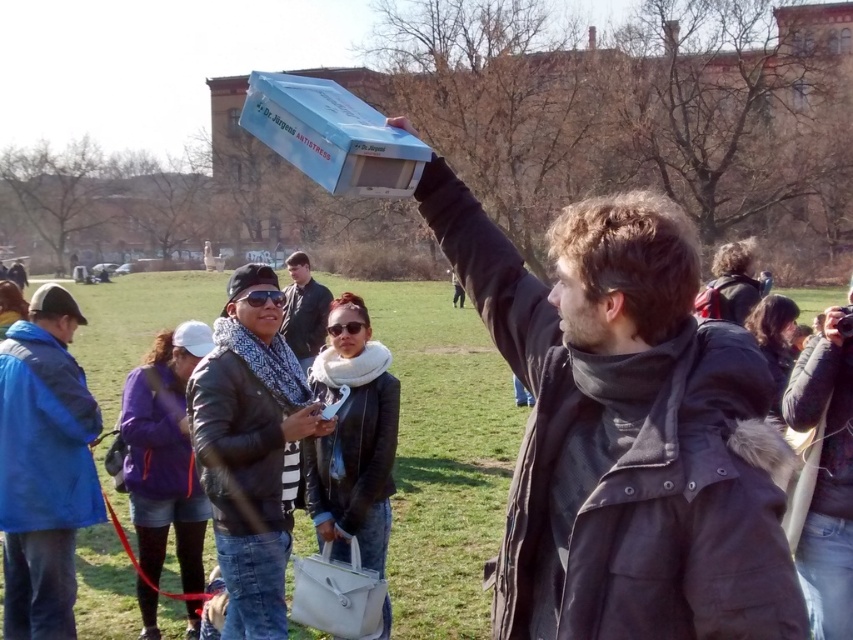
Question: Which point appears closest to the camera in this image?

Choices:
 (A) (80, 416)
 (B) (659, 252)
 (C) (242, 605)
 (D) (325, 314)

Answer: (B)

Question: Can you confirm if black leather jacket at center is positioned below leather jacket at center?

Choices:
 (A) yes
 (B) no

Answer: (A)

Question: Is black leather jacket at center bigger than blue fabric jacket at lower left?

Choices:
 (A) no
 (B) yes

Answer: (A)

Question: Which point appears closest to the camera in this image?

Choices:
 (A) click(x=314, y=288)
 (B) click(x=244, y=576)

Answer: (B)

Question: Estimate the real-world distances between objects in this image. Which object is farther from the blue fabric jacket at lower left?

Choices:
 (A) matte black jacket at center
 (B) leather jacket at center
 (C) black leather jacket at center

Answer: (A)

Question: Does black leather jacket at center appear over blue fabric jacket at lower left?

Choices:
 (A) yes
 (B) no

Answer: (A)